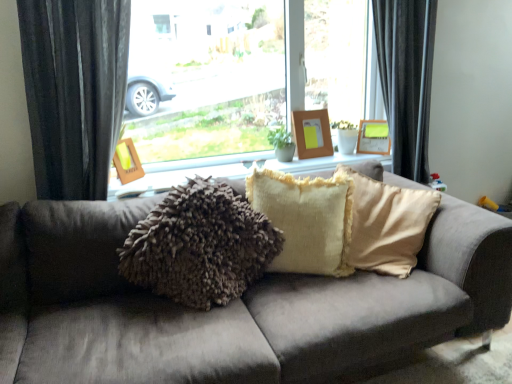
Locate an element on the screen. The image size is (512, 384). vacant region to the right of woodenwoodenpicture frame at left, the third picture frame from the right is located at coordinates (163, 175).